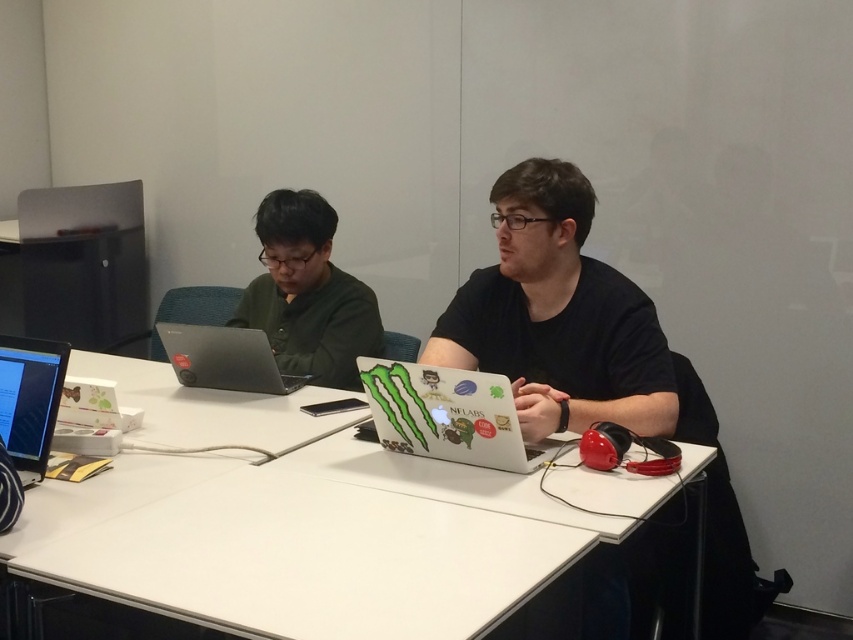
From the picture: You are a delivery robot with a package that needs to be placed between the black matte shirt at center and the silver metallic laptop at center. The package is 30 inches long. Can the package fit in the space between them?

The distance between the black matte shirt at center and the silver metallic laptop at center is 33.54 inches. Since the package is 30 inches long, it can fit in the space between them as there is enough room.

Based on the photo, you are organizing a meeting and need to place a 12 inch by 12 inch square placemat on the white matte table at center. Considering the white glossy laptop at center is already placed there, can the placemat fit entirely on the table without overlapping the laptop?

The white matte table at center is wider than the white glossy laptop at center. Since the placemat is 12x12 inches, it can fit on the table as long as there is enough space around the laptop. However, the exact placement depends on the table and laptop dimensions, but the table being wider suggests there might be enough space.

You are organizing a tech conference and need to set up a demo station. The demo requires a laptop with a screen size of at least 15 inches. You have two laptops available at the table. Based on the image, which laptop should you choose between the white glossy laptop at center and the silver metallic laptop at center?

The white glossy laptop at center is bigger than the silver metallic laptop at center, so you should choose the white glossy laptop at center for the demo as it meets the minimum screen size requirement.